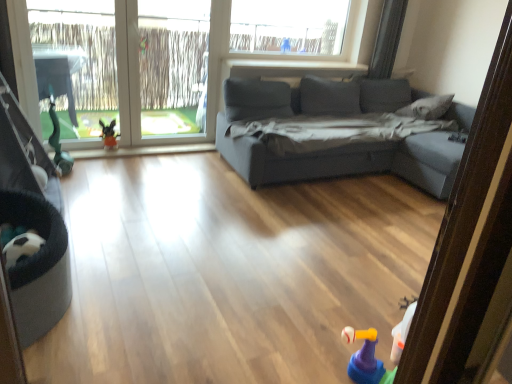
Question: Is plush toy at lower left oriented towards rubberized yellow and purple toy at lower right?

Choices:
 (A) yes
 (B) no

Answer: (A)

Question: Is rubberized yellow and purple toy at lower right at the back of plush toy at lower left?

Choices:
 (A) yes
 (B) no

Answer: (B)

Question: From a real-world perspective, is plush toy at lower left positioned under rubberized yellow and purple toy at lower right based on gravity?

Choices:
 (A) no
 (B) yes

Answer: (A)

Question: Is plush toy at lower left taller than rubberized yellow and purple toy at lower right?

Choices:
 (A) yes
 (B) no

Answer: (A)

Question: Considering the relative sizes of plush toy at lower left and rubberized yellow and purple toy at lower right in the image provided, is plush toy at lower left bigger than rubberized yellow and purple toy at lower right?

Choices:
 (A) no
 (B) yes

Answer: (B)

Question: Would you say rubberized yellow and purple toy at lower right is to the left or to the right of transparent plastic window screen at upper center in the picture?

Choices:
 (A) left
 (B) right

Answer: (B)

Question: From a real-world perspective, is rubberized yellow and purple toy at lower right above or below transparent plastic window screen at upper center?

Choices:
 (A) above
 (B) below

Answer: (B)

Question: Considering the positions of rubberized yellow and purple toy at lower right and transparent plastic window screen at upper center in the image, is rubberized yellow and purple toy at lower right wider or thinner than transparent plastic window screen at upper center?

Choices:
 (A) wide
 (B) thin

Answer: (B)

Question: Is rubberized yellow and purple toy at lower right inside or outside of transparent plastic window screen at upper center?

Choices:
 (A) inside
 (B) outside

Answer: (B)

Question: From their relative heights in the image, would you say black fabric baby carriage at lower left is taller or shorter than rubberized yellow and purple toy at lower right?

Choices:
 (A) tall
 (B) short

Answer: (A)

Question: Looking at the image, does black fabric baby carriage at lower left seem bigger or smaller compared to rubberized yellow and purple toy at lower right?

Choices:
 (A) small
 (B) big

Answer: (B)

Question: Is black fabric baby carriage at lower left wider or thinner than rubberized yellow and purple toy at lower right?

Choices:
 (A) thin
 (B) wide

Answer: (B)

Question: From a real-world perspective, relative to rubberized yellow and purple toy at lower right, is black fabric baby carriage at lower left vertically above or below?

Choices:
 (A) below
 (B) above

Answer: (B)

Question: In terms of width, does rubberized yellow and purple toy at lower right look wider or thinner when compared to clear glass window at left?

Choices:
 (A) thin
 (B) wide

Answer: (B)

Question: Considering the positions of rubberized yellow and purple toy at lower right and clear glass window at left in the image, is rubberized yellow and purple toy at lower right bigger or smaller than clear glass window at left?

Choices:
 (A) small
 (B) big

Answer: (A)